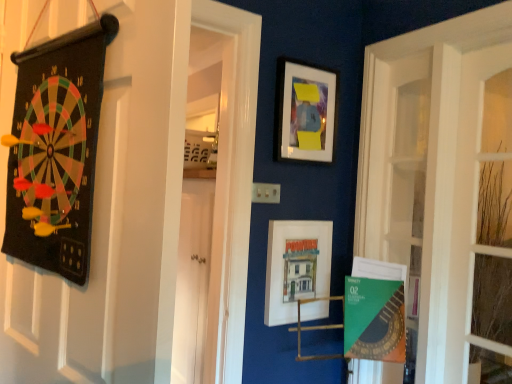
Question: Is green paper at lower right to the left or to the right of matte white picture frame at upper center, the 1th picture frame positioned from the top, in the image?

Choices:
 (A) left
 (B) right

Answer: (B)

Question: Considering the positions of green paper at lower right and matte white picture frame at upper center, marked as the second picture frame in a bottom-to-top arrangement, in the image, is green paper at lower right bigger or smaller than matte white picture frame at upper center, marked as the second picture frame in a bottom-to-top arrangement,?

Choices:
 (A) small
 (B) big

Answer: (B)

Question: Estimate the real-world distances between objects in this image. Which object is closer to the matte white picture frame at center, arranged as the 2th picture frame when viewed from the top?

Choices:
 (A) matte white picture frame at upper center, the 1th picture frame positioned from the top
 (B) green paper at lower right
 (C) black felt dartboard at left
 (D) clear glass window at right

Answer: (B)

Question: Estimate the real-world distances between objects in this image. Which object is closer to the matte white picture frame at center, arranged as the 2th picture frame when viewed from the top?

Choices:
 (A) green paper at lower right
 (B) clear glass window at right
 (C) matte white picture frame at upper center, marked as the second picture frame in a bottom-to-top arrangement
 (D) black felt dartboard at left

Answer: (A)